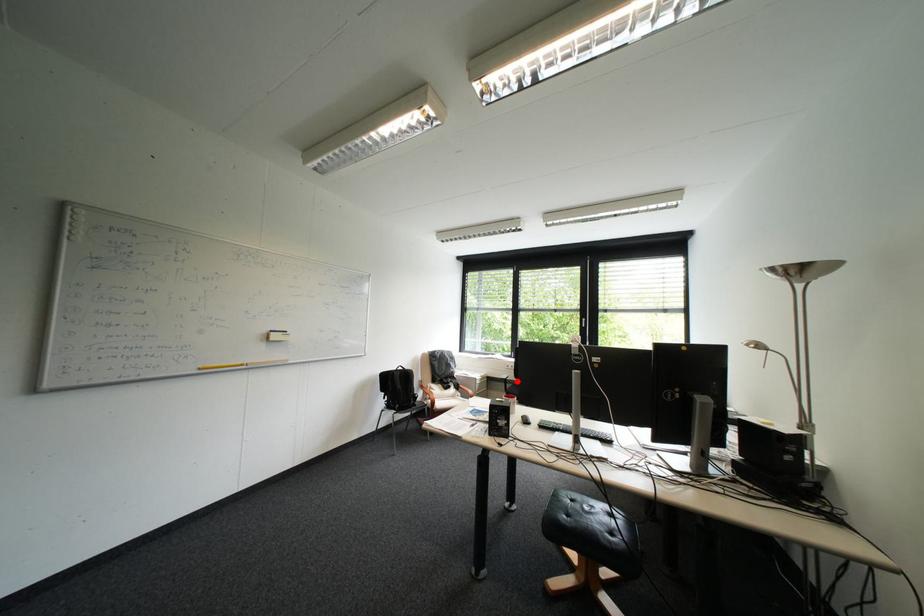
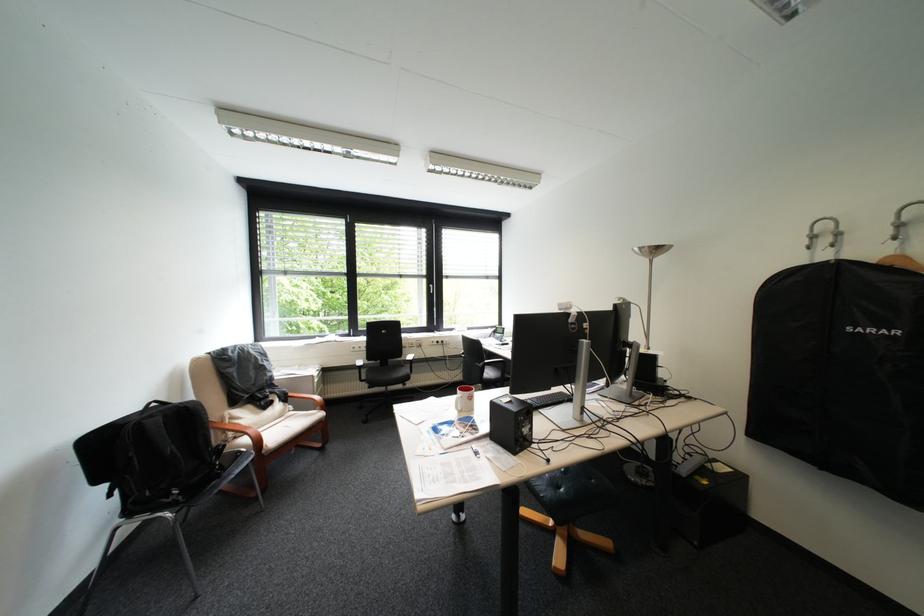
The point at the highlighted location is marked in the first image. Where is the corresponding point in the second image?

(371, 368)